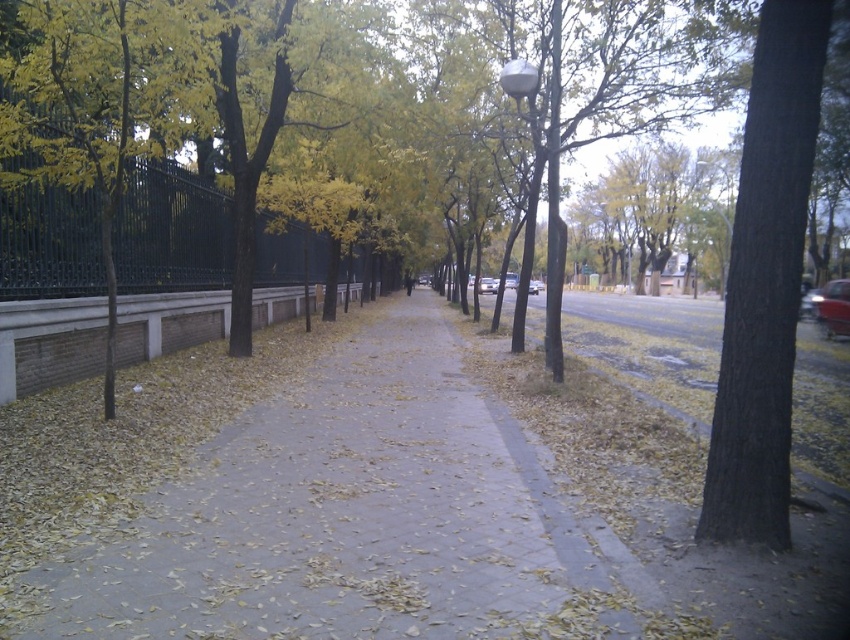
Question: Which object appears closest to the camera in this image?

Choices:
 (A) yellow-green leaves at left
 (B) dark brown textured tree trunk at right

Answer: (B)

Question: In this image, where is dark brown textured tree trunk at right located relative to yellow-green leaves at left?

Choices:
 (A) above
 (B) below

Answer: (A)

Question: Can you confirm if dark brown textured tree trunk at right is positioned to the right of yellow-green leaves at left?

Choices:
 (A) no
 (B) yes

Answer: (B)

Question: Which point is closer to the camera?

Choices:
 (A) dark brown textured tree trunk at right
 (B) yellow-green leaves at left

Answer: (A)

Question: Which object is closer to the camera taking this photo?

Choices:
 (A) yellow-green leaves at left
 (B) dark brown textured tree trunk at right

Answer: (B)

Question: Can you confirm if dark brown textured tree trunk at right is smaller than yellow-green leaves at left?

Choices:
 (A) no
 (B) yes

Answer: (A)